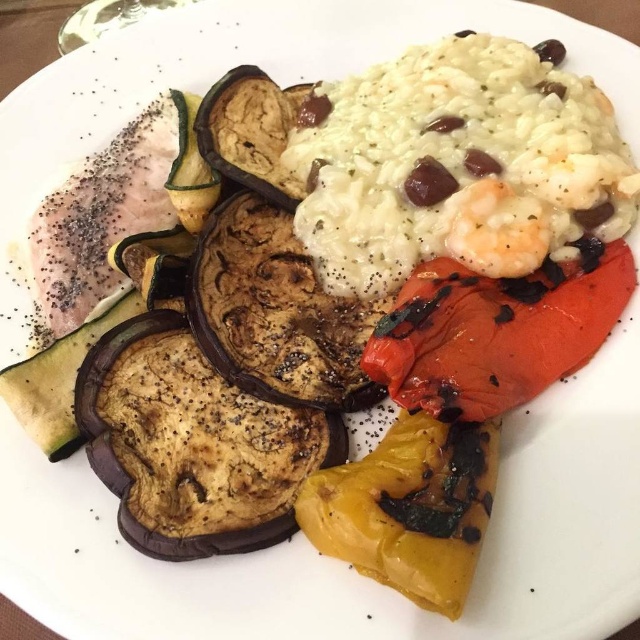
Can you confirm if charred red pepper at right is positioned above yellow charred pepper at lower center?

Indeed, charred red pepper at right is positioned over yellow charred pepper at lower center.

Between charred red pepper at right and yellow charred pepper at lower center, which one appears on the left side from the viewer's perspective?

yellow charred pepper at lower center is more to the left.

I want to click on charred red pepper at right, so click(x=493, y=332).

In order to click on charred red pepper at right in this screenshot , I will do `click(493, 332)`.

Is point (449, 45) farther from viewer compared to point (339, 528)?

That is True.

At what (x,y) coordinates should I click in order to perform the action: click on white creamy rice at upper right. Please return your answer as a coordinate pair (x, y). This screenshot has width=640, height=640. Looking at the image, I should click on (454, 164).

Is point (625, 211) behind point (346, 557)?

Yes, it is behind point (346, 557).

The image size is (640, 640). In order to click on white creamy rice at upper right in this screenshot , I will do `click(454, 164)`.

Is white creamy rice at upper right further to camera compared to charred red pepper at right?

Yes, white creamy rice at upper right is further from the viewer.

Does white creamy rice at upper right appear on the left side of charred red pepper at right?

Indeed, white creamy rice at upper right is positioned on the left side of charred red pepper at right.

Where is `white creamy rice at upper right`? white creamy rice at upper right is located at coordinates (454, 164).

Where is `white creamy rice at upper right`? white creamy rice at upper right is located at coordinates (454, 164).